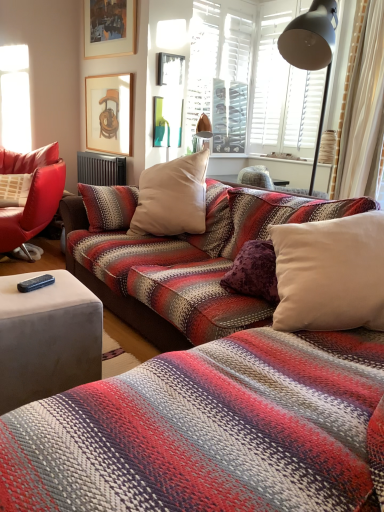
Identify the location of free space in front of black rubber remote control at lower left. The width and height of the screenshot is (384, 512). click(33, 296).